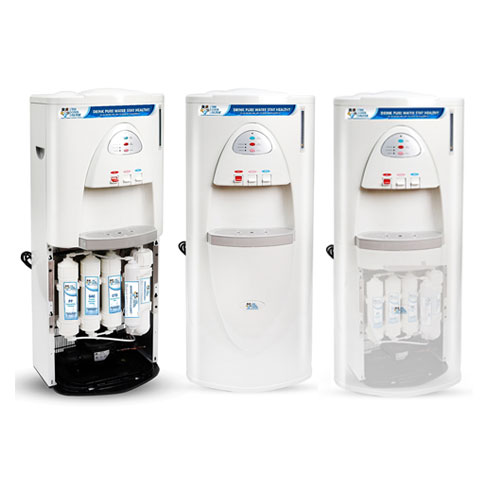
You are a GUI agent. You are given a task and a screenshot of the screen. Output one action in this format:
    pyautogui.click(x=<x>, y=<y>)
    Task: Click on the red switch
    
    Given the screenshot: What is the action you would take?
    pyautogui.click(x=113, y=180), pyautogui.click(x=237, y=179), pyautogui.click(x=384, y=182)